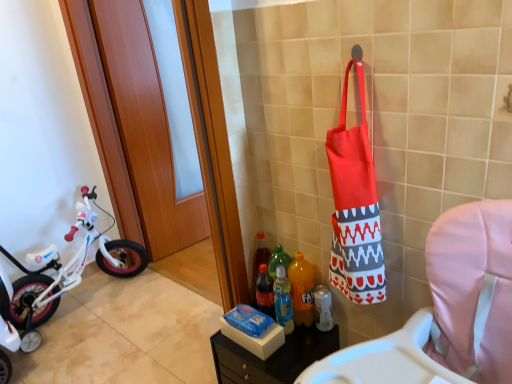
How much space does orange plastic bottle at center, the second bottle in the right-to-left sequence, occupy vertically?

The height of orange plastic bottle at center, the second bottle in the right-to-left sequence, is 11.86 inches.

What do you see at coordinates (446, 311) in the screenshot? I see `fabric highchair at right` at bounding box center [446, 311].

This screenshot has height=384, width=512. Describe the element at coordinates (272, 357) in the screenshot. I see `matte plastic tray at lower center` at that location.

Measure the distance between point (x=329, y=278) and camera.

A distance of 5.17 feet exists between point (x=329, y=278) and camera.

What is the approximate height of red fabric tote bag at right?

red fabric tote bag at right is 30.38 inches tall.

Identify the location of white plastic can at lower center, the third bottle when ordered from left to right. (323, 308).

Where is `orange plastic bottle at center, the second bottle in the left-to-right sequence`? orange plastic bottle at center, the second bottle in the left-to-right sequence is located at coordinates (302, 290).

From the image's perspective, is matte plastic tray at lower center located beneath white plastic can at lower center, the third bottle when ordered from left to right?

Indeed, from the image's perspective, matte plastic tray at lower center is shown beneath white plastic can at lower center, the third bottle when ordered from left to right.

Are matte plastic tray at lower center and white plastic can at lower center, the third bottle when ordered from left to right, far apart?

No, matte plastic tray at lower center is not far from white plastic can at lower center, the third bottle when ordered from left to right.

Is matte plastic tray at lower center aimed at white plastic can at lower center, which is the first bottle from right to left?

No, matte plastic tray at lower center is not oriented towards white plastic can at lower center, which is the first bottle from right to left.

Where is `the 3rd bottle to the right of the matte plastic tray at lower center, starting your count from the anchor`? The height and width of the screenshot is (384, 512). the 3rd bottle to the right of the matte plastic tray at lower center, starting your count from the anchor is located at coordinates (323, 308).

Considering the sizes of red fabric tote bag at right and matte plastic tray at lower center in the image, is red fabric tote bag at right bigger or smaller than matte plastic tray at lower center?

In the image, red fabric tote bag at right appears to be smaller than matte plastic tray at lower center.

Is red fabric tote bag at right located outside matte plastic tray at lower center?

red fabric tote bag at right lies outside matte plastic tray at lower center's area.

Is red fabric tote bag at right in contact with matte plastic tray at lower center?

red fabric tote bag at right and matte plastic tray at lower center are clearly separated.

Looking at this image, does red fabric tote bag at right have a greater height compared to matte plastic tray at lower center?

Correct, red fabric tote bag at right is much taller as matte plastic tray at lower center.

Could translucent plastic bottle at lower center, which is the 3th bottle from right to left, be considered to be inside matte plastic tray at lower center?

That's incorrect, translucent plastic bottle at lower center, which is the 3th bottle from right to left, is not inside matte plastic tray at lower center.

Can you tell me how much matte plastic tray at lower center and translucent plastic bottle at lower center, acting as the first bottle starting from the left, differ in facing direction?

0.236 degrees.

From a real-world perspective, who is located higher, matte plastic tray at lower center or translucent plastic bottle at lower center, acting as the first bottle starting from the left?

From a 3D spatial view, translucent plastic bottle at lower center, acting as the first bottle starting from the left, is above.

What are the coordinates of `the 2nd bottle positioned above the matte plastic tray at lower center (from a real-world perspective)` in the screenshot? It's located at (283, 301).

Which is further, (291, 353) or (423, 308)?

Point (291, 353)

The width and height of the screenshot is (512, 384). Identify the location of furniture below the fabric highchair at right (from the image's perspective). click(x=272, y=357).

Who is more distant, matte plastic tray at lower center or fabric highchair at right?

matte plastic tray at lower center is further away from the camera.

From a real-world perspective, who is located higher, matte plastic tray at lower center or fabric highchair at right?

fabric highchair at right is physically above.

From a real-world perspective, between white matte bicycle at left and white plastic can at lower center, which is the first bottle from right to left, who is vertically higher?

From a 3D spatial view, white matte bicycle at left is above.

In the scene shown: Is white matte bicycle at left outside of white plastic can at lower center, which is the first bottle from right to left?

Yes, white matte bicycle at left is not within white plastic can at lower center, which is the first bottle from right to left.

From the image's perspective, is white matte bicycle at left located above or below white plastic can at lower center, the third bottle when ordered from left to right?

white matte bicycle at left is above white plastic can at lower center, the third bottle when ordered from left to right.

Can you confirm if red fabric tote bag at right is shorter than fabric highchair at right?

Indeed, red fabric tote bag at right has a lesser height compared to fabric highchair at right.

Measure the distance from red fabric tote bag at right to fabric highchair at right.

A distance of 15.24 inches exists between red fabric tote bag at right and fabric highchair at right.

Which object is wider, red fabric tote bag at right or fabric highchair at right?

With larger width is fabric highchair at right.

In the image, is red fabric tote bag at right on the left side or the right side of fabric highchair at right?

From the image, it's evident that red fabric tote bag at right is to the left of fabric highchair at right.

Could you tell me if red fabric tote bag at right is turned towards wooden at left?

No, red fabric tote bag at right is not facing towards wooden at left.

From a real-world perspective, relative to wooden at left, is red fabric tote bag at right vertically above or below?

Clearly, from a real-world perspective, red fabric tote bag at right is above wooden at left.

Is red fabric tote bag at right next to wooden at left?

red fabric tote bag at right and wooden at left are clearly separated.

Image resolution: width=512 pixels, height=384 pixels. I want to click on furniture located below the white plastic can at lower center, the third bottle when ordered from left to right (from the image's perspective), so click(x=272, y=357).

Image resolution: width=512 pixels, height=384 pixels. I want to click on pouch above the matte plastic tray at lower center (from the image's perspective), so click(355, 207).

Looking at the image, which one is located closer to white plastic can at lower center, which is the first bottle from right to left, orange plastic bottle at center, the second bottle in the left-to-right sequence, or wooden at left?

Among the two, orange plastic bottle at center, the second bottle in the left-to-right sequence, is located nearer to white plastic can at lower center, which is the first bottle from right to left.

Looking at this image, considering their positions, is fabric highchair at right positioned further to translucent plastic bottle at lower center, which is the 3th bottle from right to left, than white matte bicycle at left?

Based on the image, white matte bicycle at left appears to be further to translucent plastic bottle at lower center, which is the 3th bottle from right to left.

Estimate the real-world distances between objects in this image. Which object is further from wooden at left, red fabric tote bag at right or white plastic can at lower center, which is the first bottle from right to left?

red fabric tote bag at right is further to wooden at left.

Based on their spatial positions, is red fabric tote bag at right or orange plastic bottle at center, the second bottle in the right-to-left sequence, closer to white matte bicycle at left?

The object closer to white matte bicycle at left is orange plastic bottle at center, the second bottle in the right-to-left sequence.

From the image, which object appears to be nearer to translucent plastic bottle at lower center, which is the 3th bottle from right to left, wooden at left or white plastic can at lower center, the third bottle when ordered from left to right?

white plastic can at lower center, the third bottle when ordered from left to right, lies closer to translucent plastic bottle at lower center, which is the 3th bottle from right to left, than the other object.

In the scene shown: Considering their positions, is wooden at left positioned further to white matte bicycle at left than white plastic can at lower center, the third bottle when ordered from left to right?

Among the two, white plastic can at lower center, the third bottle when ordered from left to right, is located further to white matte bicycle at left.

When comparing their distances from wooden at left, does translucent plastic bottle at lower center, which is the 3th bottle from right to left, or white matte bicycle at left seem closer?

white matte bicycle at left.

When comparing their distances from wooden at left, does matte plastic tray at lower center or white matte bicycle at left seem closer?

The object closer to wooden at left is white matte bicycle at left.

Locate an element on the screen. The image size is (512, 384). furniture situated between white matte bicycle at left and orange plastic bottle at center, the second bottle in the left-to-right sequence, from left to right is located at coordinates [x=272, y=357].

Locate an element on the screen. This screenshot has height=384, width=512. bottle between translucent plastic bottle at lower center, which is the 3th bottle from right to left, and white plastic can at lower center, which is the first bottle from right to left, in the horizontal direction is located at coordinates (302, 290).

Identify the location of furniture positioned between fabric highchair at right and white plastic can at lower center, which is the first bottle from right to left, from near to far. The image size is (512, 384). (272, 357).

Where is `furniture between white matte bicycle at left and fabric highchair at right in the horizontal direction`? The image size is (512, 384). furniture between white matte bicycle at left and fabric highchair at right in the horizontal direction is located at coordinates (272, 357).